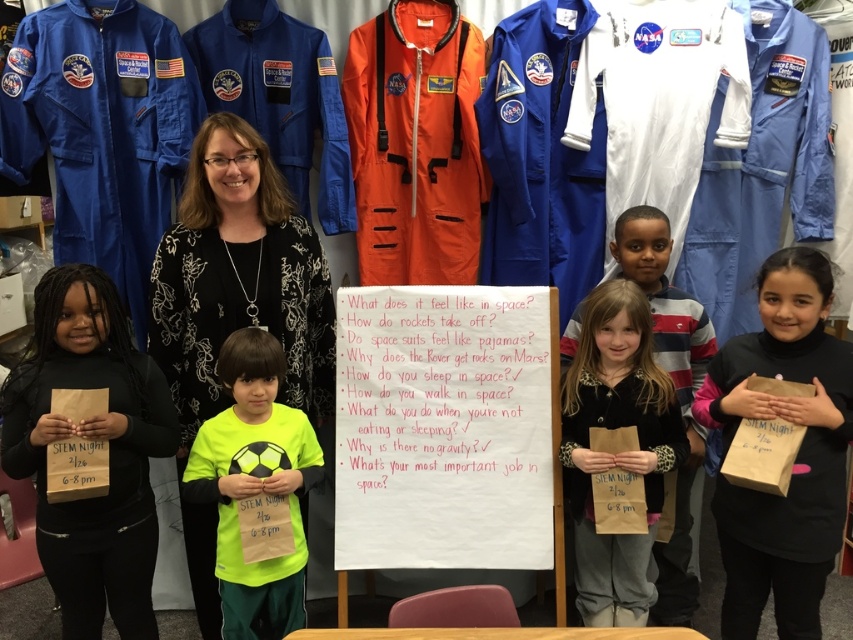
Question: Estimate the real-world distances between objects in this image. Which object is closer to the neon green t-shirt at center?

Choices:
 (A) black satin blouse at center
 (B) matte brown paper bag at center

Answer: (A)

Question: Does brown paper bag at lower left appear under neon green t-shirt at center?

Choices:
 (A) no
 (B) yes

Answer: (A)

Question: Is the position of black satin blouse at center more distant than that of neon green t-shirt at center?

Choices:
 (A) yes
 (B) no

Answer: (A)

Question: Which point is closer to the camera?

Choices:
 (A) black satin blouse at center
 (B) matte brown paper bag at center
 (C) brown paper bag at lower left

Answer: (C)

Question: Can you confirm if brown paper bag at lower right is positioned below matte brown paper bag at center?

Choices:
 (A) yes
 (B) no

Answer: (A)

Question: Which point appears closest to the camera in this image?

Choices:
 (A) [x=793, y=461]
 (B) [x=100, y=371]
 (C) [x=204, y=625]

Answer: (A)